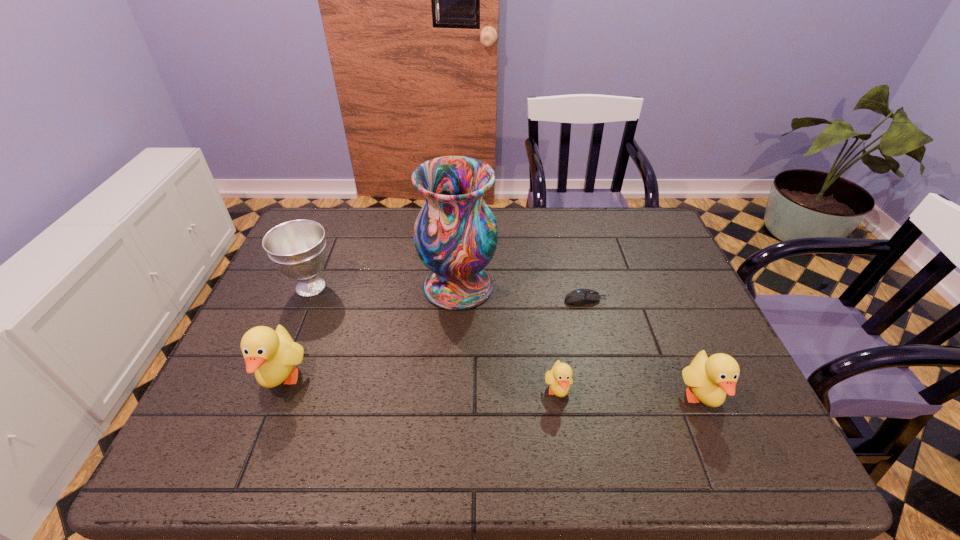
You are a GUI agent. You are given a task and a screenshot of the screen. Output one action in this format:
    pyautogui.click(x=<x>, y=<y>)
    Task: Click on the leftmost duckling
    
    Given the screenshot: What is the action you would take?
    pyautogui.click(x=272, y=355)

Identify the location of the second shortest object. (559, 379).

I want to click on the second duckling from right to left, so click(x=559, y=379).

Identify the location of the fourth tallest object. tap(709, 379).

Locate an element on the screen. the second tallest duckling is located at coordinates (709, 379).

Image resolution: width=960 pixels, height=540 pixels. Identify the location of vase. (455, 234).

Identify the location of the third object from left to right. (455, 234).

Image resolution: width=960 pixels, height=540 pixels. I want to click on the shortest object, so click(579, 297).

The image size is (960, 540). I want to click on computer mouse, so click(x=579, y=297).

Locate an element on the screen. Image resolution: width=960 pixels, height=540 pixels. chalice is located at coordinates (297, 248).